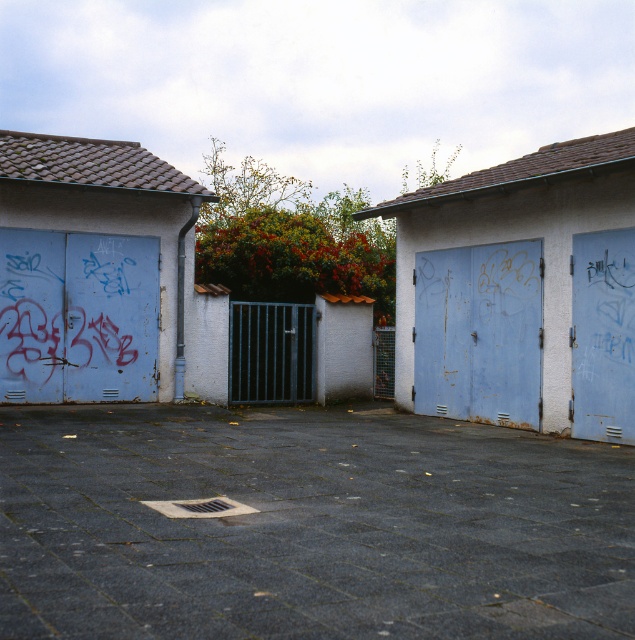
You are a painter who needs to choose a door to paint first. You have a limited amount of paint that can cover 2 square meters. The rusty metal garage door at left and the rusty blue door at center both need repainting. Based on their sizes, which door should you paint first to ensure you have enough paint for both?

The rusty blue door at center should be painted first because the rusty metal garage door at left is wider, requiring more paint. By starting with the smaller rusty blue door at center, you can ensure there will be enough paint left for the larger rusty metal garage door at left.

You are a delivery person trying to find the entrance to the building. You see a rusty metal garage door at left and a rusty metal door at right. Which door is closer to the left side of the path?

The rusty metal garage door at left is positioned on the left side of the rusty metal door at right, so it is closer to the left side of the path.